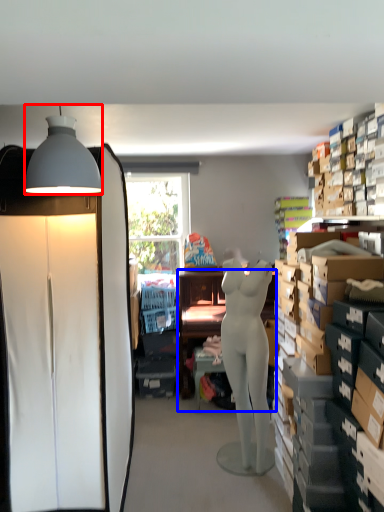
Question: Which point is closer to the camera, lamp (highlighted by a red box) or desk (highlighted by a blue box)?

Choices:
 (A) lamp
 (B) desk

Answer: (A)